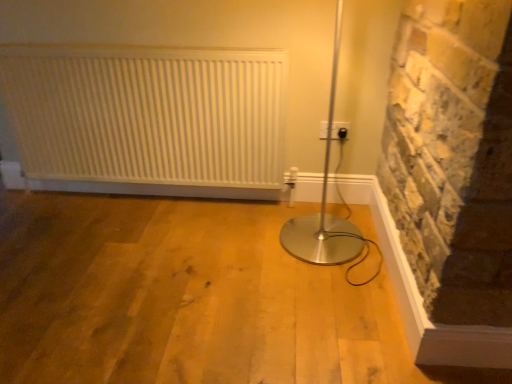
Question: Is black plastic electric outlet at upper right behind white matte radiator at upper left?

Choices:
 (A) no
 (B) yes

Answer: (B)

Question: From a real-world perspective, is black plastic electric outlet at upper right over white matte radiator at upper left?

Choices:
 (A) no
 (B) yes

Answer: (A)

Question: Is black plastic electric outlet at upper right bigger than white matte radiator at upper left?

Choices:
 (A) yes
 (B) no

Answer: (B)

Question: From a real-world perspective, is black plastic electric outlet at upper right below white matte radiator at upper left?

Choices:
 (A) yes
 (B) no

Answer: (A)

Question: Does black plastic electric outlet at upper right have a greater width compared to white matte radiator at upper left?

Choices:
 (A) yes
 (B) no

Answer: (B)

Question: Considering the relative sizes of black plastic electric outlet at upper right and white matte radiator at upper left in the image provided, is black plastic electric outlet at upper right shorter than white matte radiator at upper left?

Choices:
 (A) no
 (B) yes

Answer: (B)

Question: Does white matte radiator at upper left appear on the left side of black plastic electric outlet at upper right?

Choices:
 (A) no
 (B) yes

Answer: (B)

Question: Is white matte radiator at upper left positioned in front of black plastic electric outlet at upper right?

Choices:
 (A) no
 (B) yes

Answer: (B)

Question: Can you confirm if white matte radiator at upper left is positioned to the right of black plastic electric outlet at upper right?

Choices:
 (A) yes
 (B) no

Answer: (B)

Question: Does white matte radiator at upper left contain black plastic electric outlet at upper right?

Choices:
 (A) no
 (B) yes

Answer: (A)

Question: Is white matte radiator at upper left located outside black plastic electric outlet at upper right?

Choices:
 (A) no
 (B) yes

Answer: (B)

Question: From the image's perspective, is white matte radiator at upper left below black plastic electric outlet at upper right?

Choices:
 (A) no
 (B) yes

Answer: (A)

Question: Considering the positions of black plastic electric outlet at upper right and white matte radiator at upper left in the image, is black plastic electric outlet at upper right wider or thinner than white matte radiator at upper left?

Choices:
 (A) thin
 (B) wide

Answer: (A)